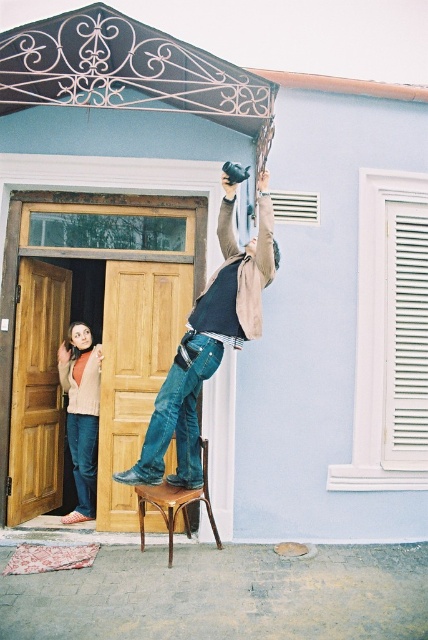
Does denim jeans at center have a greater width compared to brown wooden chair at center?

Yes, denim jeans at center is wider than brown wooden chair at center.

Looking at this image, which is above, denim jeans at center or brown wooden chair at center?

denim jeans at center is higher up.

Is point (226, 300) positioned behind point (204, 490)?

No, it is not.

You are a GUI agent. You are given a task and a screenshot of the screen. Output one action in this format:
    pyautogui.click(x=<x>, y=<y>)
    Task: Click on the denim jeans at center
    This screenshot has height=640, width=428.
    Given the screenshot: What is the action you would take?
    pyautogui.click(x=208, y=342)

Can you confirm if black wrought iron canopy at upper center is positioned to the right of brown wooden chair at center?

In fact, black wrought iron canopy at upper center is to the left of brown wooden chair at center.

Can you confirm if black wrought iron canopy at upper center is thinner than brown wooden chair at center?

No.

Is point (198, 68) positioned behind point (201, 499)?

No, (198, 68) is in front of (201, 499).

This screenshot has width=428, height=640. What are the coordinates of `black wrought iron canopy at upper center` in the screenshot? It's located at (124, 70).

Does black wrought iron canopy at upper center appear under denim jeans at left?

No.

Which is behind, point (127, 54) or point (71, 452)?

Positioned behind is point (71, 452).

Which is behind, point (80, 28) or point (94, 420)?

Point (94, 420)

Identify the location of black wrought iron canopy at upper center. (124, 70).